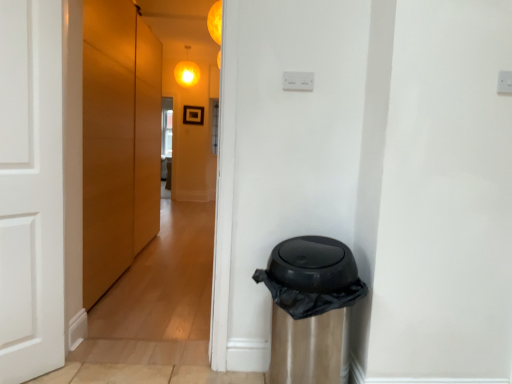
Question: From the image's perspective, does orange matte light at upper center, placed as the second light when sorted from left to right, appear lower than black plastic waste bin at lower right?

Choices:
 (A) yes
 (B) no

Answer: (B)

Question: Does orange matte light at upper center, arranged as the 2th light when viewed from the top, appear on the right side of black plastic waste bin at lower right?

Choices:
 (A) no
 (B) yes

Answer: (A)

Question: Considering the relative sizes of orange matte light at upper center, arranged as the 2th light when viewed from the top, and black plastic waste bin at lower right in the image provided, is orange matte light at upper center, arranged as the 2th light when viewed from the top, bigger than black plastic waste bin at lower right?

Choices:
 (A) no
 (B) yes

Answer: (A)

Question: Does orange matte light at upper center, placed as the second light when sorted from left to right, appear on the left side of black plastic waste bin at lower right?

Choices:
 (A) yes
 (B) no

Answer: (A)

Question: Can you confirm if orange matte light at upper center, the second light in the back-to-front sequence, is smaller than black plastic waste bin at lower right?

Choices:
 (A) no
 (B) yes

Answer: (B)

Question: Which is correct: matte yellow globe at upper center, which is the second light in right-to-left order, is inside black plastic waste bin at lower right, or outside of it?

Choices:
 (A) inside
 (B) outside

Answer: (B)

Question: Relative to black plastic waste bin at lower right, is matte yellow globe at upper center, the first light viewed from the back, in front or behind?

Choices:
 (A) behind
 (B) front

Answer: (A)

Question: Looking at the image, does matte yellow globe at upper center, which is the second light in right-to-left order, seem bigger or smaller compared to black plastic waste bin at lower right?

Choices:
 (A) small
 (B) big

Answer: (B)

Question: Is point (186, 69) closer or farther from the camera than point (310, 339)?

Choices:
 (A) closer
 (B) farther

Answer: (B)

Question: Is point (215, 19) closer or farther from the camera than point (324, 324)?

Choices:
 (A) closer
 (B) farther

Answer: (A)

Question: In terms of height, does orange matte light at upper center, marked as the first light in a right-to-left arrangement, look taller or shorter compared to black plastic waste bin at lower right?

Choices:
 (A) tall
 (B) short

Answer: (B)

Question: Do you think orange matte light at upper center, which appears as the 1th light when ordered from the bottom, is within black plastic waste bin at lower right, or outside of it?

Choices:
 (A) outside
 (B) inside

Answer: (A)

Question: In the image, is orange matte light at upper center, placed as the second light when sorted from left to right, on the left side or the right side of black plastic waste bin at lower right?

Choices:
 (A) right
 (B) left

Answer: (B)

Question: From the image's perspective, is matte wood door at left above or below orange matte light at upper center, placed as the second light when sorted from left to right?

Choices:
 (A) above
 (B) below

Answer: (B)

Question: Is point (96, 185) closer or farther from the camera than point (207, 18)?

Choices:
 (A) farther
 (B) closer

Answer: (A)